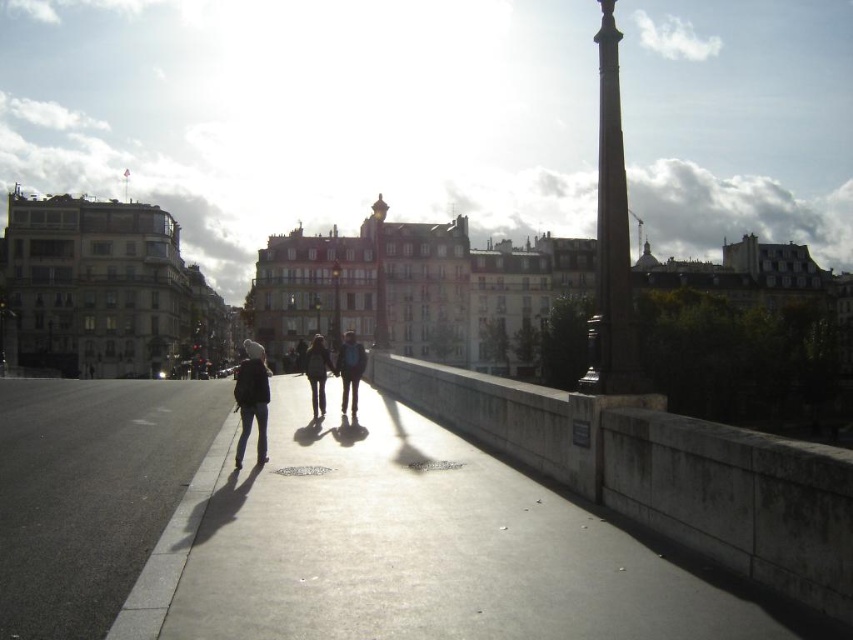
Looking at this image, you are standing on the bridge and see the polished stone column at right and the dark gray jeans at center. Which object is closer to you?

The polished stone column at right is closer to you because it is positioned over the dark gray jeans at center, indicating it is in front of them.